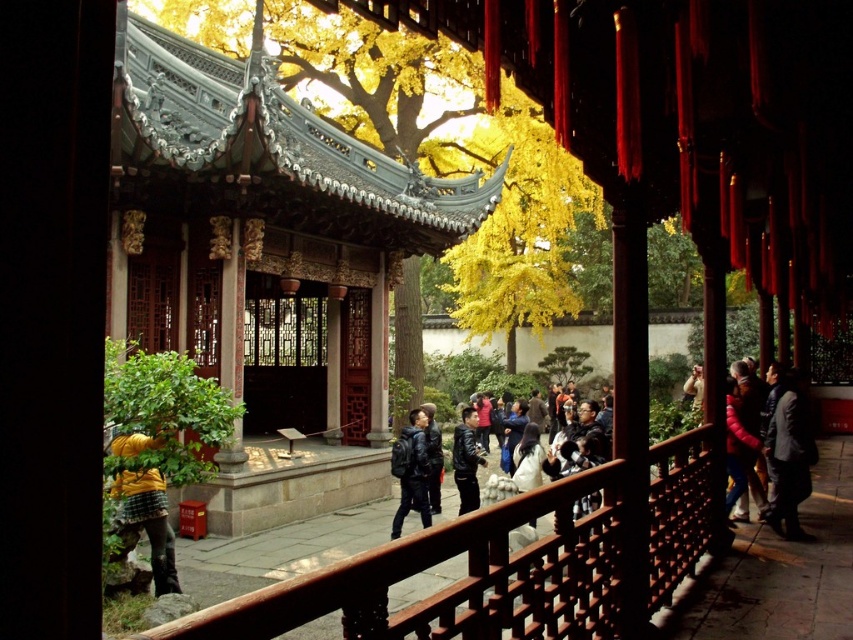
Who is more distant from viewer, (398, 515) or (432, 448)?

Point (432, 448)

Which is in front, point (399, 483) or point (434, 504)?

Point (434, 504) is in front.

Does point (404, 445) lie behind point (434, 448)?

No, (404, 445) is closer to viewer.

You are a GUI agent. You are given a task and a screenshot of the screen. Output one action in this format:
    pyautogui.click(x=<x>, y=<y>)
    Task: Click on the black matte backpack at center
    This screenshot has height=640, width=853.
    Given the screenshot: What is the action you would take?
    pyautogui.click(x=410, y=472)

Describe the element at coordinates (512, 564) in the screenshot. Image resolution: width=853 pixels, height=640 pixels. I see `brown wooden railing at center` at that location.

Between brown wooden railing at center and black matte backpack at center, which one has less height?

Standing shorter between the two is black matte backpack at center.

Image resolution: width=853 pixels, height=640 pixels. I want to click on brown wooden railing at center, so click(512, 564).

Can you confirm if brown wooden railing at center is thinner than yellow leafy tree at center?

Yes.

Measure the distance between brown wooden railing at center and camera.

The distance of brown wooden railing at center from camera is 9.51 meters.

This screenshot has height=640, width=853. Describe the element at coordinates (512, 564) in the screenshot. I see `brown wooden railing at center` at that location.

Where is `brown wooden railing at center`? The height and width of the screenshot is (640, 853). brown wooden railing at center is located at coordinates (512, 564).